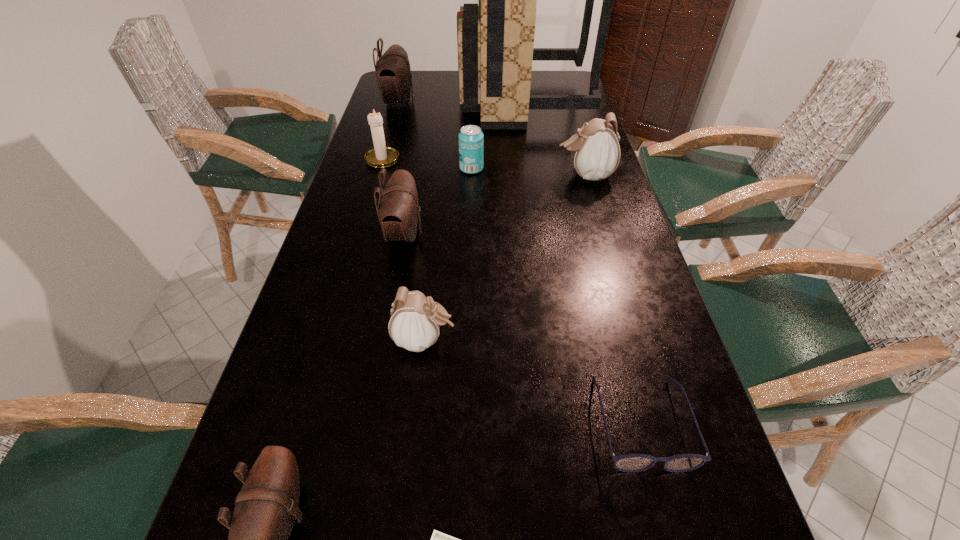
I want to click on beer can, so click(x=470, y=139).

I want to click on spectacles, so click(x=631, y=463).

Where is `vacant space situated on the front face of the backpack`? This screenshot has width=960, height=540. vacant space situated on the front face of the backpack is located at coordinates (391, 99).

Find the location of `vacant space located on the front face of the backpack`. vacant space located on the front face of the backpack is located at coordinates (432, 99).

You are a GUI agent. You are given a task and a screenshot of the screen. Output one action in this format:
    pyautogui.click(x=<x>, y=<y>)
    Task: Click on the vacant position located 0.220m on the front face of the backpack
    
    Given the screenshot: What is the action you would take?
    pyautogui.click(x=399, y=99)

Find the location of a particular element. free region located with the flap open on the farthest brown pouch is located at coordinates (498, 103).

You are a GUI agent. You are given a task and a screenshot of the screen. Output one action in this format:
    pyautogui.click(x=<x>, y=<y>)
    Task: Click on the vacant area located 0.080m on the front-facing side of the bigger white pouch
    
    Given the screenshot: What is the action you would take?
    pyautogui.click(x=529, y=175)

At what (x,y) coordinates should I click in order to perform the action: click on vacant space located on the front-facing side of the bigger white pouch. Please return your answer as a coordinate pair (x, y). Looking at the image, I should click on 487,175.

Find the location of a particular element. Image resolution: width=960 pixels, height=540 pixels. free space located on the front-facing side of the bigger white pouch is located at coordinates (448, 175).

This screenshot has height=540, width=960. In order to click on free region located with the flap open on the second nearest brown pouch in this screenshot , I will do `click(558, 234)`.